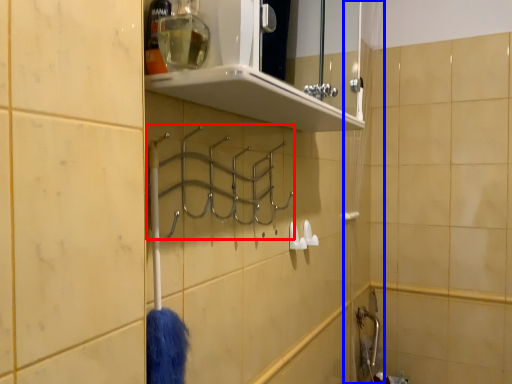
Question: Which object is closer to the camera taking this photo, hanger (highlighted by a red box) or shower curtain (highlighted by a blue box)?

Choices:
 (A) hanger
 (B) shower curtain

Answer: (A)